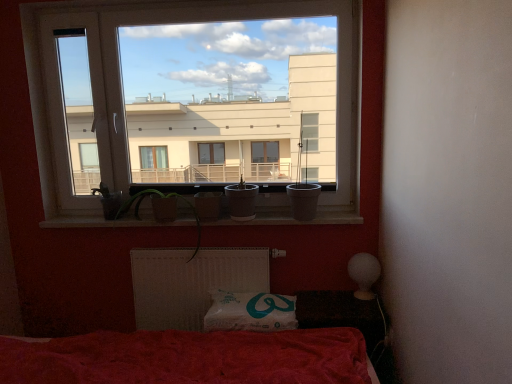
Question: From the image's perspective, is transparent glass window at upper center beneath smooth concrete window sill at center?

Choices:
 (A) yes
 (B) no

Answer: (B)

Question: Does transparent glass window at upper center have a greater height compared to smooth concrete window sill at center?

Choices:
 (A) no
 (B) yes

Answer: (B)

Question: Can you confirm if transparent glass window at upper center is positioned to the right of smooth concrete window sill at center?

Choices:
 (A) yes
 (B) no

Answer: (B)

Question: From a real-world perspective, is transparent glass window at upper center under smooth concrete window sill at center?

Choices:
 (A) yes
 (B) no

Answer: (B)

Question: Is transparent glass window at upper center smaller than smooth concrete window sill at center?

Choices:
 (A) no
 (B) yes

Answer: (A)

Question: Is point (251, 198) positioned closer to the camera than point (331, 213)?

Choices:
 (A) closer
 (B) farther

Answer: (A)

Question: From the image's perspective, relative to smooth concrete window sill at center, is matte white pot at center above or below?

Choices:
 (A) above
 (B) below

Answer: (A)

Question: Is matte white pot at center situated inside smooth concrete window sill at center or outside?

Choices:
 (A) inside
 (B) outside

Answer: (B)

Question: From a real-world perspective, is matte white pot at center above or below smooth concrete window sill at center?

Choices:
 (A) above
 (B) below

Answer: (A)

Question: Visually, is white fabric pillow at lower center positioned to the left or to the right of smooth concrete window sill at center?

Choices:
 (A) left
 (B) right

Answer: (B)

Question: In terms of size, does white fabric pillow at lower center appear bigger or smaller than smooth concrete window sill at center?

Choices:
 (A) big
 (B) small

Answer: (A)

Question: Is point pos(216,321) closer or farther from the camera than point pos(42,223)?

Choices:
 (A) farther
 (B) closer

Answer: (B)

Question: Relative to smooth concrete window sill at center, is white fabric pillow at lower center in front or behind?

Choices:
 (A) front
 (B) behind

Answer: (A)

Question: Is smooth concrete window sill at center situated inside transparent glass window at upper center or outside?

Choices:
 (A) inside
 (B) outside

Answer: (B)

Question: Considering the positions of smooth concrete window sill at center and transparent glass window at upper center in the image, is smooth concrete window sill at center wider or thinner than transparent glass window at upper center?

Choices:
 (A) thin
 (B) wide

Answer: (B)